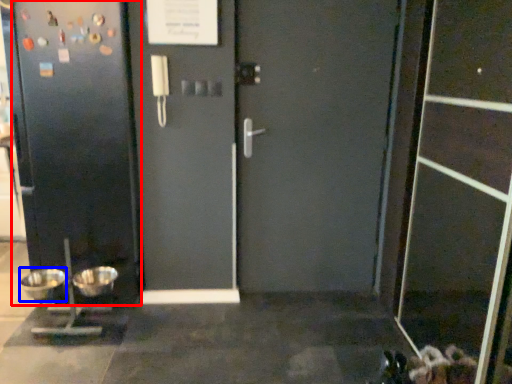
Question: Which point is further to the camera, door (highlighted by a red box) or mixing bowl (highlighted by a blue box)?

Choices:
 (A) door
 (B) mixing bowl

Answer: (B)